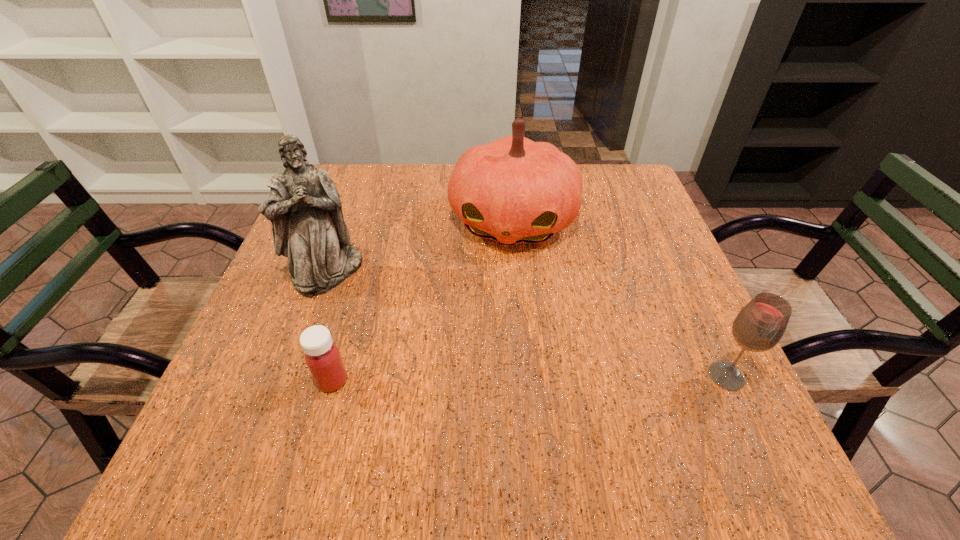
Where is `vacant space on the desktop that is between the shortest object and the glass drink container and is positioned on the front-facing side of the third shortest object`? vacant space on the desktop that is between the shortest object and the glass drink container and is positioned on the front-facing side of the third shortest object is located at coordinates (480, 379).

Locate an element on the screen. The image size is (960, 540). vacant space on the desktop that is between the shortest object and the third tallest object and is positioned on the front-facing side of the figurine is located at coordinates (472, 379).